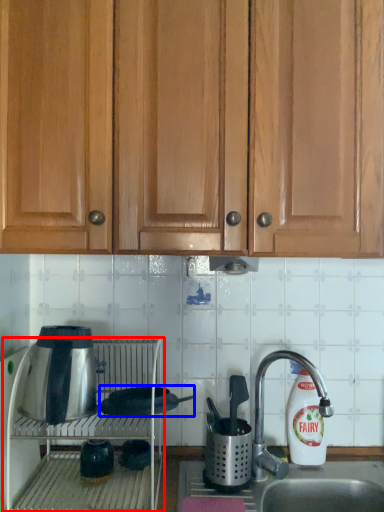
Question: Among these objects, which one is farthest to the camera, oven (highlighted by a red box) or appliance (highlighted by a blue box)?

Choices:
 (A) oven
 (B) appliance

Answer: (B)